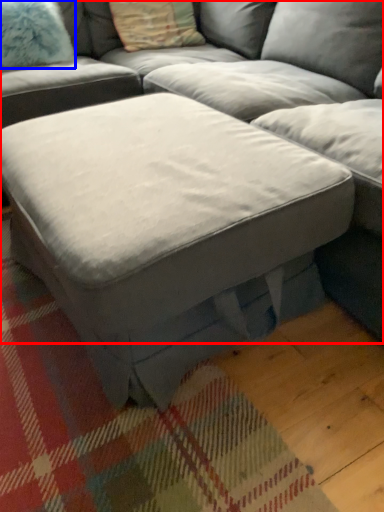
Question: Which object appears farthest to the camera in this image, studio couch (highlighted by a red box) or pillow (highlighted by a blue box)?

Choices:
 (A) studio couch
 (B) pillow

Answer: (B)